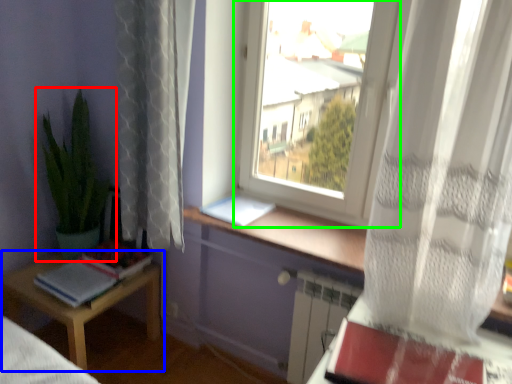
Question: Which is nearer to the houseplant (highlighted by a red box)? table (highlighted by a blue box) or window (highlighted by a green box).

Choices:
 (A) table
 (B) window

Answer: (A)